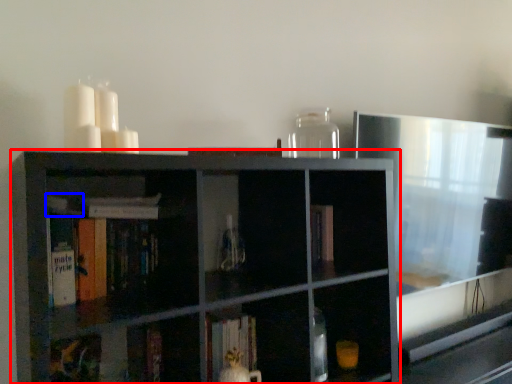
Question: Which object appears closest to the camera in this image, shelf (highlighted by a red box) or book (highlighted by a blue box)?

Choices:
 (A) shelf
 (B) book

Answer: (A)